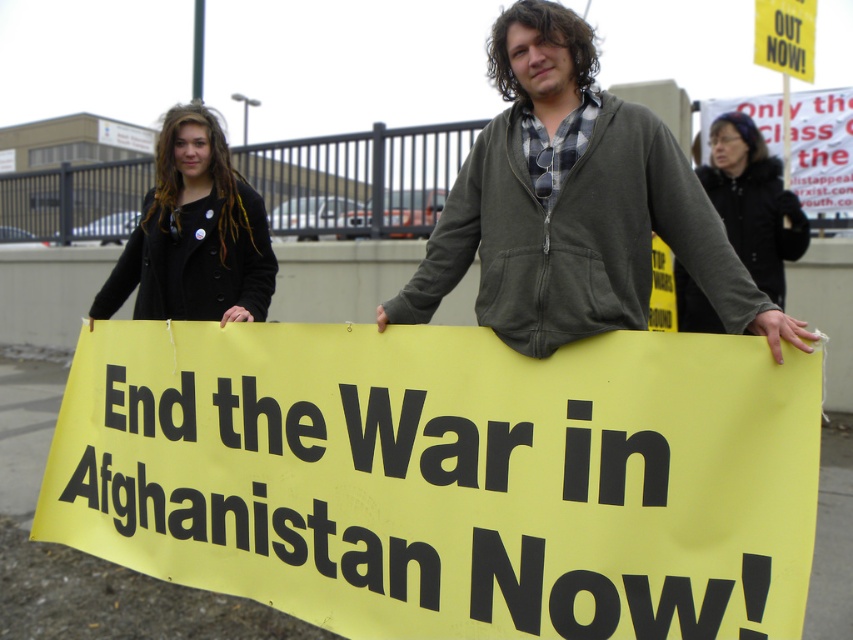
How far apart are black wool coat at upper left and black fur coat at upper right?

black wool coat at upper left and black fur coat at upper right are 3.24 meters apart from each other.

Can you confirm if black wool coat at upper left is bigger than black fur coat at upper right?

No, black wool coat at upper left is not bigger than black fur coat at upper right.

Does point (178, 106) lie in front of point (751, 125)?

That is True.

Locate an element on the screen. This screenshot has height=640, width=853. black wool coat at upper left is located at coordinates (194, 234).

Who is taller, yellow paper sign at center or black fur coat at upper right?

With more height is black fur coat at upper right.

Is yellow paper sign at center bigger than black fur coat at upper right?

Yes, yellow paper sign at center is bigger than black fur coat at upper right.

Is point (585, 621) behind point (720, 173)?

No, (585, 621) is in front of (720, 173).

Locate an element on the screen. yellow paper sign at center is located at coordinates (445, 476).

Between black fur coat at upper right and white paper sign at upper right, which one appears on the left side from the viewer's perspective?

black fur coat at upper right is more to the left.

Is black fur coat at upper right wider than white paper sign at upper right?

No.

Identify the location of black fur coat at upper right. The image size is (853, 640). (753, 202).